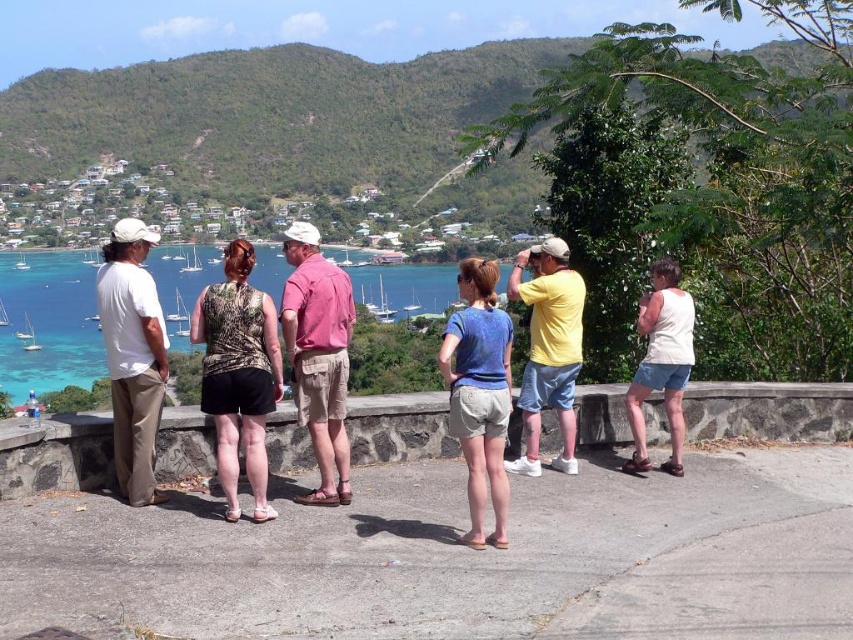
Is camouflage fabric tank top at center above white cotton shirt at left?

Actually, camouflage fabric tank top at center is below white cotton shirt at left.

Does point (215, 310) come in front of point (136, 428)?

Yes, point (215, 310) is closer to viewer.

Is point (202, 378) farther from viewer compared to point (143, 385)?

That is True.

Find the location of `camouflage fabric tank top at center`. camouflage fabric tank top at center is located at coordinates (238, 372).

Based on the photo, how distant is white cotton shirt at left from blue cotton shirt at center?

white cotton shirt at left and blue cotton shirt at center are 2.68 meters apart from each other.

Who is taller, white cotton shirt at left or blue cotton shirt at center?

With more height is white cotton shirt at left.

Between point (154, 381) and point (480, 468), which one is positioned behind?

Point (154, 381)

This screenshot has height=640, width=853. Find the location of `white cotton shirt at left`. white cotton shirt at left is located at coordinates (132, 355).

Is turquoise water at center positioned at the back of camouflage fabric tank top at center?

Yes, it is.

Does turquoise water at center have a greater width compared to camouflage fabric tank top at center?

Correct, the width of turquoise water at center exceeds that of camouflage fabric tank top at center.

In the scene shown: Who is more forward, [55,388] or [260,340]?

Point [260,340] is in front.

What are the coordinates of `turquoise water at center` in the screenshot? It's located at [x=49, y=323].